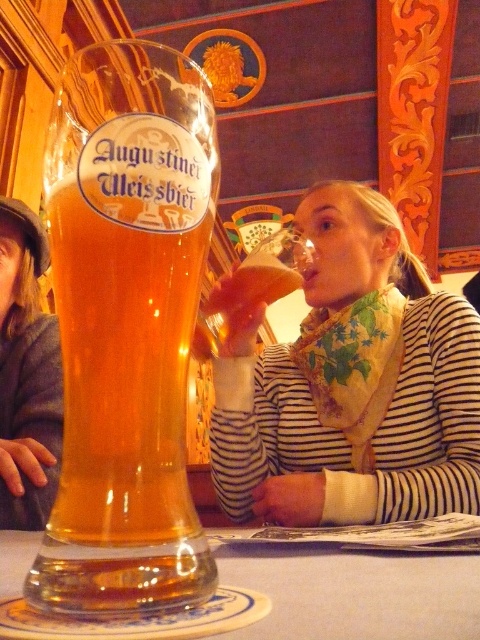
You are a customer in the beer hall and want to place your striped fabric scarf at upper center on the coaster with the blue and yellow design. Can you reach it without moving from your current position?

The striped fabric scarf at upper center and viewer are 30.61 inches apart from each other, so yes, you can reach it without moving from your current position.

You are a photographer trying to capture the Augustiner Weissbier glass in the foreground without the striped fabric scarf at upper center overlapping it. Given their positions, can you position yourself so that the translucent glass at lower center is fully visible while the scarf is out of frame?

The striped fabric scarf at upper center has a greater height compared to the translucent glass at lower center. Since the scarf is taller, you can position yourself lower to ensure the scarf is out of frame while keeping the translucent glass at lower center visible.